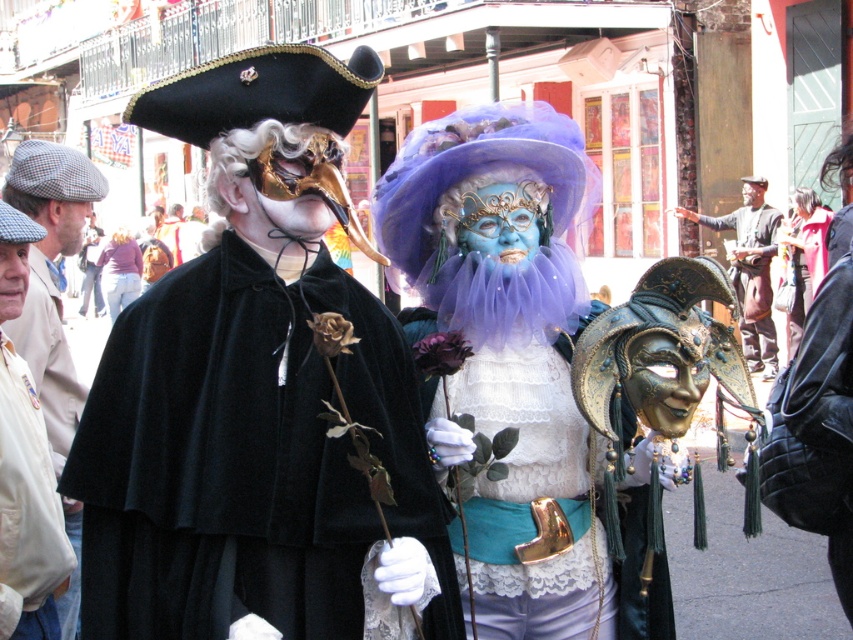
You are a photographer trying to capture the perfect shot of the white cotton shirt at lower left and the light pink fabric pants at lower left. From which side of the pants should you position yourself to frame both items in the same shot?

You should position yourself to the right of the light pink fabric pants at lower left because the white cotton shirt at lower left is located to the right of the light pink fabric pants at lower left, allowing both to be framed together in the shot.

You are a photographer trying to capture a wide shot of the light beige fabric cap at left and the light pink fabric pants at lower left. Given that your camera has a maximum focus range of 40 meters, will you be able to fit both objects into the frame without moving closer?

The light beige fabric cap at left and light pink fabric pants at lower left are 40.84 meters apart, which exceeds the camera maximum focus range of 40 meters. Therefore, you cannot fit both objects into the frame without moving closer.

What is the position of the point at coordinates (247, 458) in the image?

The point at coordinates (247, 458) is located on the velvet black cape at center.